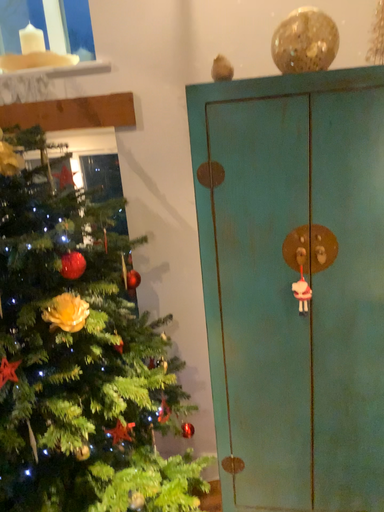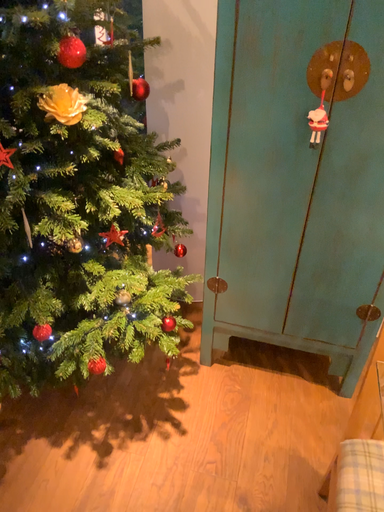
Question: How did the camera likely rotate when shooting the video?

Choices:
 (A) rotated upward
 (B) rotated downward

Answer: (B)